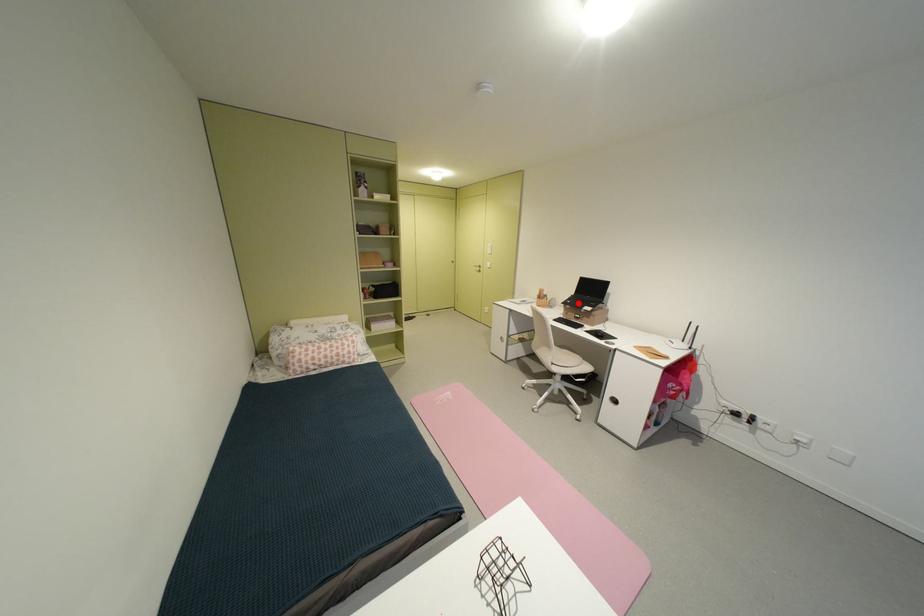
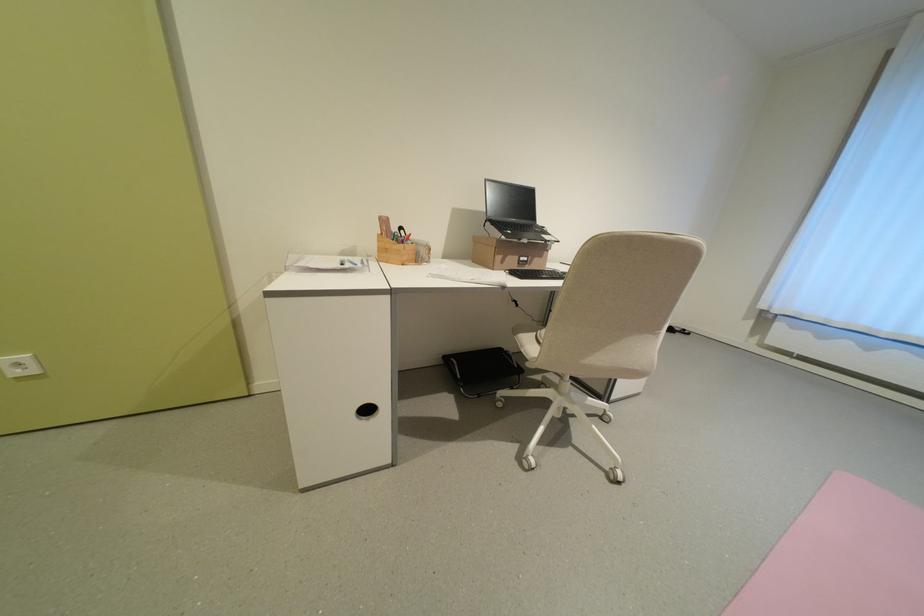
The point at the highlighted location is marked in the first image. Where is the corresponding point in the second image?

(518, 233)